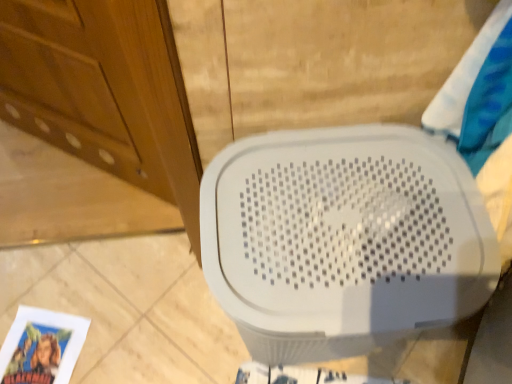
Image resolution: width=512 pixels, height=384 pixels. Describe the element at coordinates (343, 239) in the screenshot. I see `white plastic toilet at center` at that location.

Where is `white plastic toilet at center`? white plastic toilet at center is located at coordinates (343, 239).

Measure the distance between point (307, 247) and camera.

Point (307, 247) is 25.31 inches from camera.

Where is `white plastic toilet at center`? white plastic toilet at center is located at coordinates (343, 239).